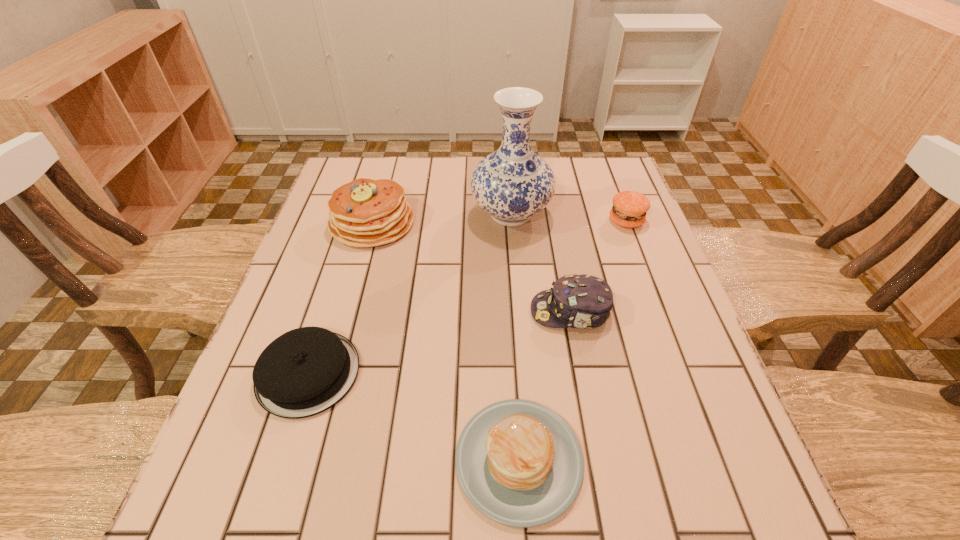
The image size is (960, 540). What are the coordinates of `the tallest object` in the screenshot? It's located at (512, 184).

In order to click on the second tallest object in this screenshot , I will do pos(365,212).

Find the location of a particular element. The image size is (960, 540). the farthest pancake is located at coordinates (365, 212).

Identify the location of headwear. (578, 301).

Where is `patty`? patty is located at coordinates (629, 209).

Where is `the rightmost pancake`? This screenshot has height=540, width=960. the rightmost pancake is located at coordinates (519, 463).

Identify the location of free space located on the back of the vase. The width and height of the screenshot is (960, 540). (508, 177).

Find the location of `vacant space located 0.140m on the back of the second tallest object`. vacant space located 0.140m on the back of the second tallest object is located at coordinates (386, 173).

This screenshot has height=540, width=960. Find the location of `vacant position located 0.220m on the front-facing side of the headwear`. vacant position located 0.220m on the front-facing side of the headwear is located at coordinates (431, 312).

At what (x,y) coordinates should I click in order to perform the action: click on vacant space located on the front-facing side of the headwear. Please return your answer as a coordinate pair (x, y). The height and width of the screenshot is (540, 960). Looking at the image, I should click on (386, 312).